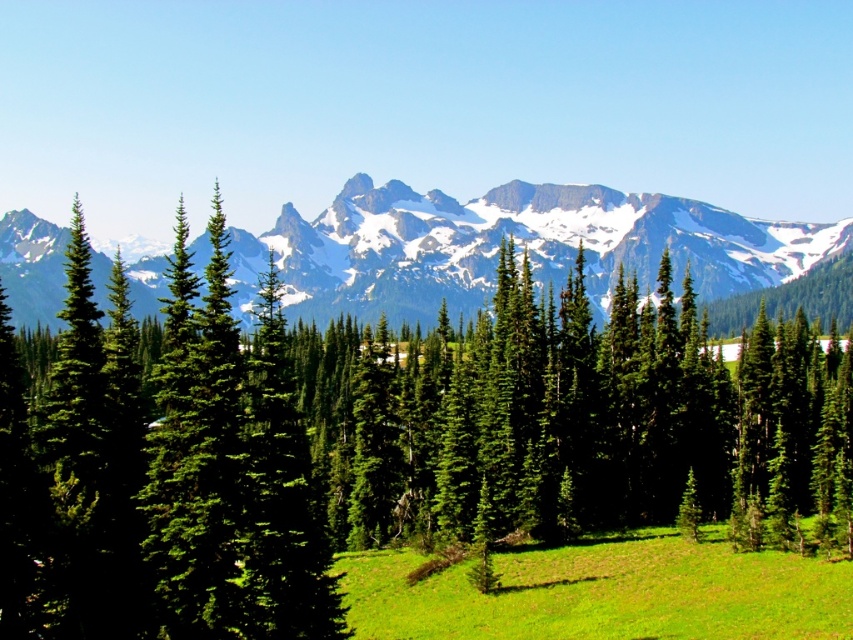
How far apart are green matte evergreen tree at center and snowy granite mountain range at upper center?

The distance of green matte evergreen tree at center from snowy granite mountain range at upper center is 197.52 meters.

Who is positioned more to the left, green matte evergreen tree at center or snowy granite mountain range at upper center?

Positioned to the left is green matte evergreen tree at center.

Is point (231, 620) less distant than point (386, 305)?

Yes.

Identify the location of green matte evergreen tree at center. (160, 476).

Where is `snowy granite mountain range at upper center`? snowy granite mountain range at upper center is located at coordinates (515, 243).

Is snowy granite mountain range at upper center shorter than green grassy field at center?

Incorrect, snowy granite mountain range at upper center's height does not fall short of green grassy field at center's.

Identify the location of snowy granite mountain range at upper center. The height and width of the screenshot is (640, 853). (515, 243).

Does green matte tree at center have a smaller size compared to green grassy field at center?

Incorrect, green matte tree at center is not smaller in size than green grassy field at center.

Is point (635, 481) farther from viewer compared to point (782, 636)?

That is True.

The width and height of the screenshot is (853, 640). I want to click on green matte tree at center, so coord(379,442).

Identify the location of green matte tree at center. Image resolution: width=853 pixels, height=640 pixels. pyautogui.click(x=379, y=442).